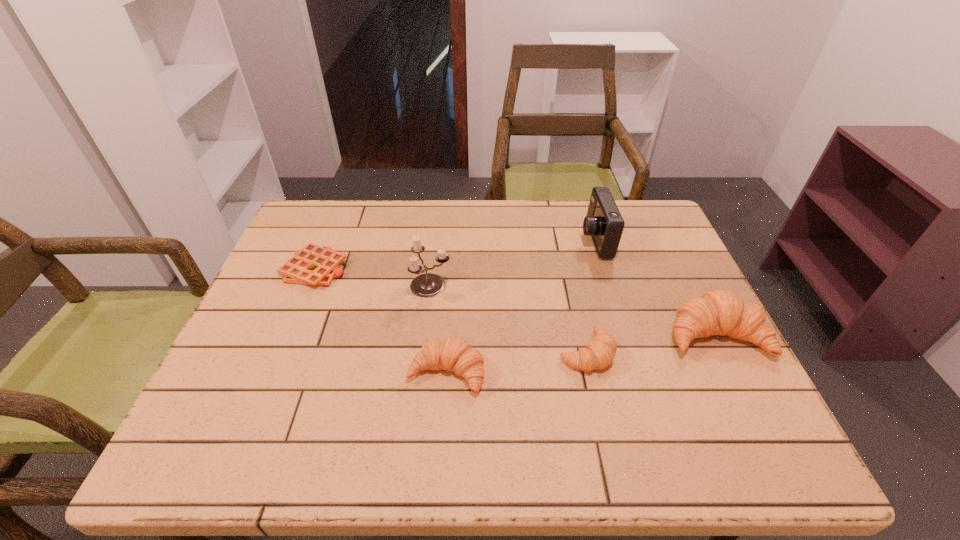
Find the location of `the third shortest object`. the third shortest object is located at coordinates (455, 354).

In order to click on the second shortest crescent roll in this screenshot , I will do `click(455, 354)`.

I want to click on the second shortest object, so click(x=599, y=353).

Locate an element on the screen. The image size is (960, 540). the shortest crescent roll is located at coordinates (599, 353).

This screenshot has height=540, width=960. Find the location of `the rightmost crescent roll`. the rightmost crescent roll is located at coordinates (720, 312).

Locate an element on the screen. the tallest crescent roll is located at coordinates (720, 312).

Identify the location of waffle. 314,265.

Identify the location of the leftmost object. The image size is (960, 540). (314, 265).

Identify the location of camera. (604, 223).

Find the location of a particular element. Image resolution: width=960 pixels, height=540 pixels. candle holder is located at coordinates (427, 285).